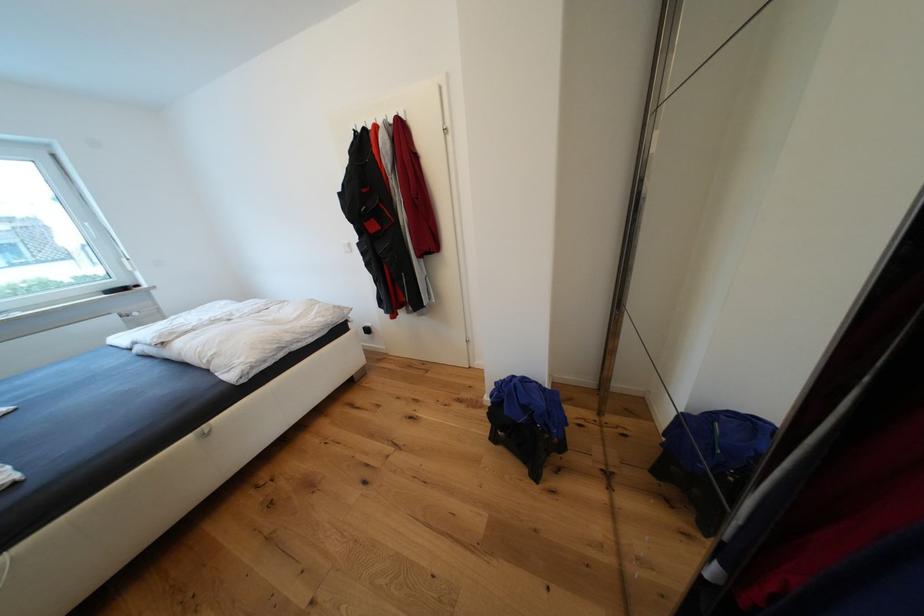
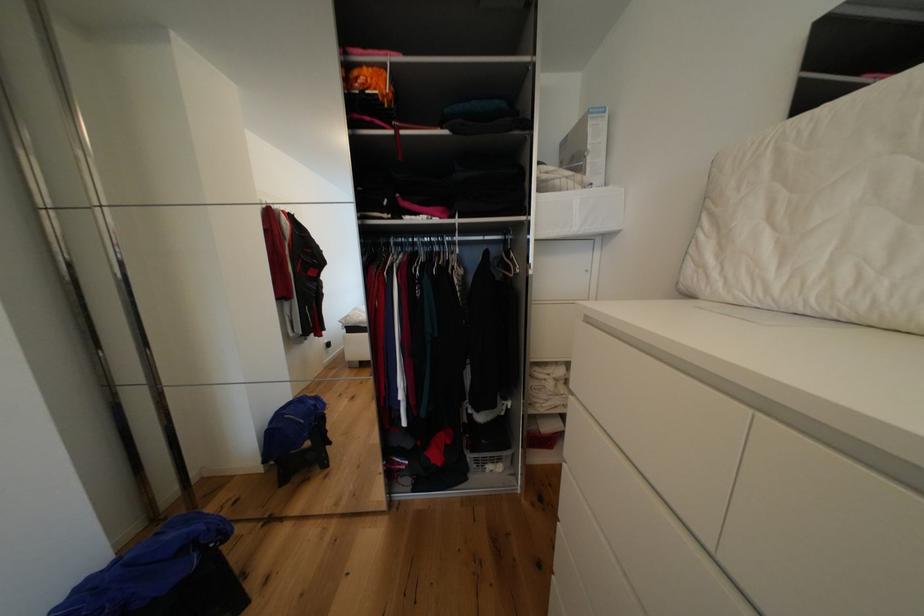
The first image is from the beginning of the video and the second image is from the end. How did the camera likely rotate when shooting the video?

The camera rotated toward right-down.